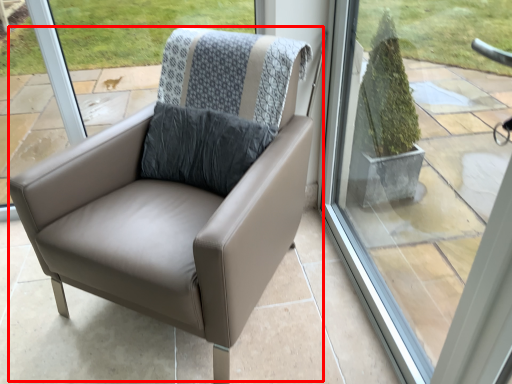
Question: Where is chair (annotated by the red box) located in relation to window in the image?

Choices:
 (A) right
 (B) left

Answer: (B)